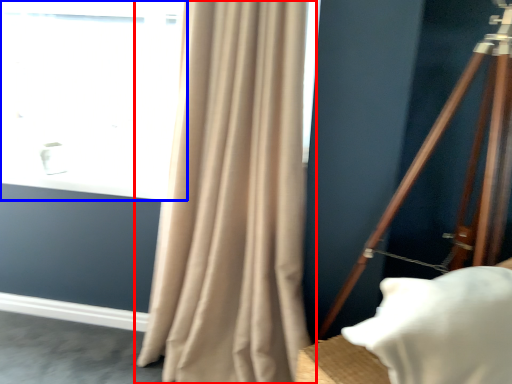
Question: Which object is closer to the camera taking this photo, curtain (highlighted by a red box) or window (highlighted by a blue box)?

Choices:
 (A) curtain
 (B) window

Answer: (A)